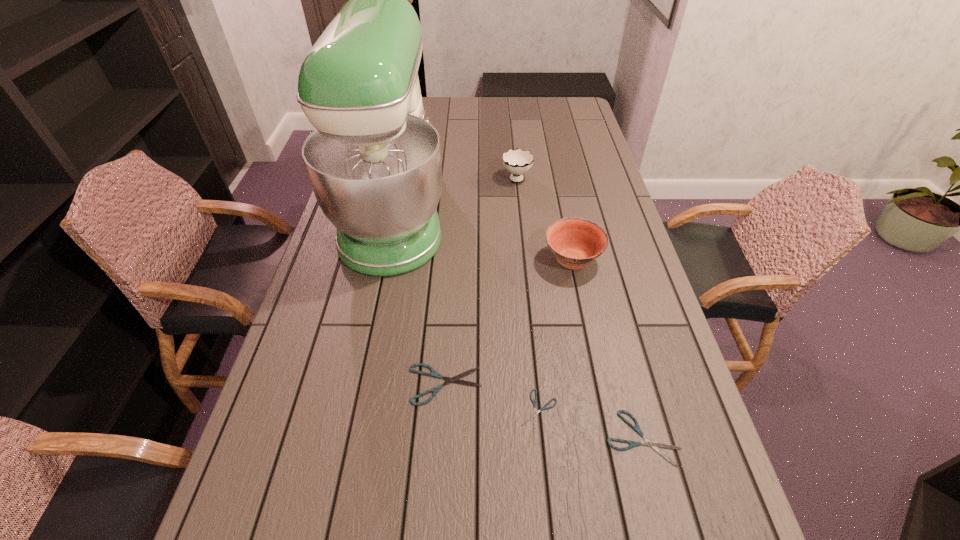
Find the location of `the leftmost shears`. the leftmost shears is located at coordinates (455, 379).

The width and height of the screenshot is (960, 540). I want to click on the shortest object, so click(544, 407).

At what (x,y) coordinates should I click in order to perform the action: click on the second shears from right to left. Please return your answer as a coordinate pair (x, y). The image size is (960, 540). Looking at the image, I should click on click(x=544, y=407).

The width and height of the screenshot is (960, 540). Identify the location of the second tallest shears. (654, 445).

The height and width of the screenshot is (540, 960). I want to click on the rightmost shears, so click(654, 445).

Locate an element on the screen. cup is located at coordinates (517, 162).

I want to click on the tallest object, so click(374, 161).

Identify the location of bowl. (576, 242).

Find the location of a particular element. This screenshot has width=960, height=540. free space located 0.110m on the left of the leftmost shears is located at coordinates (360, 384).

At what (x,y) coordinates should I click in order to perform the action: click on free space located 0.090m on the front of the shortest shears. Please return your answer as a coordinate pair (x, y). Looking at the image, I should click on (546, 476).